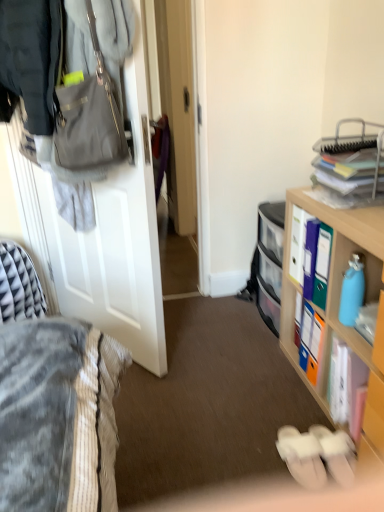
Question: In terms of height, does white paper book at lower right look taller or shorter compared to white matte door at left?

Choices:
 (A) tall
 (B) short

Answer: (B)

Question: Based on their sizes in the image, would you say white paper book at lower right is bigger or smaller than white matte door at left?

Choices:
 (A) big
 (B) small

Answer: (B)

Question: Estimate the real-world distances between objects in this image. Which object is farther from the white fabric slippers at lower center, positioned as the second footwear in left-to-right order?

Choices:
 (A) white matte door at left
 (B) white paper book at lower right
 (C) matte gray handbag at upper left
 (D) clear plastic drawers at center
 (E) wooden cabinet at right

Answer: (C)

Question: Estimate the real-world distances between objects in this image. Which object is farther from the white fabric slippers at lower center, the first footwear from the left?

Choices:
 (A) white matte door at left
 (B) white paper book at lower right
 (C) white fabric slippers at lower center, positioned as the second footwear in left-to-right order
 (D) matte gray handbag at upper left
 (E) wooden cabinet at right

Answer: (D)